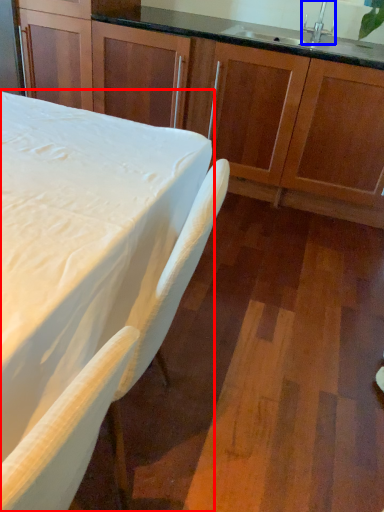
Question: Which point is closer to the camera, table (highlighted by a red box) or faucet (highlighted by a blue box)?

Choices:
 (A) table
 (B) faucet

Answer: (A)